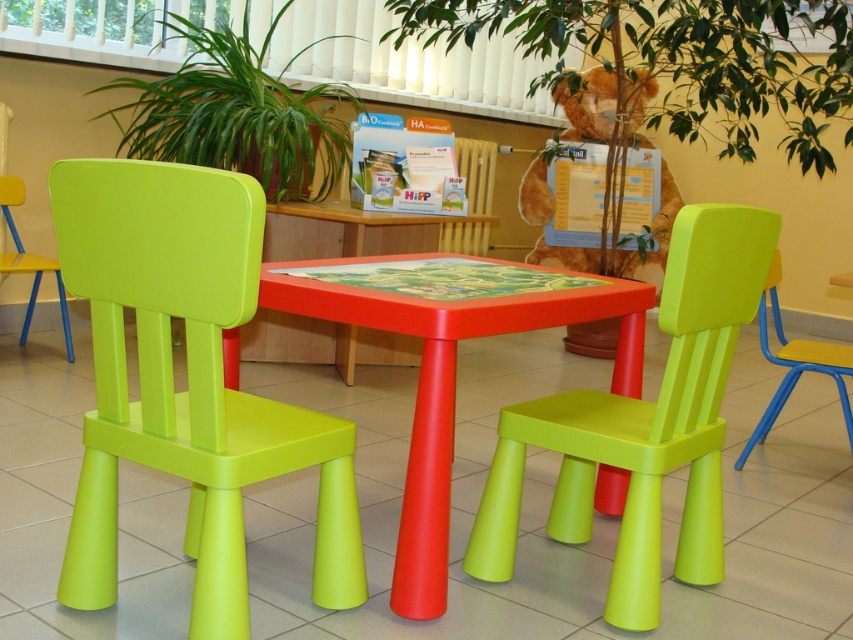
Question: Which object is the farthest from the lime matte plastic chair at center?

Choices:
 (A) lime green plastic chair at center
 (B) green plastic chair at center
 (C) green leafy plant at upper left

Answer: (C)

Question: Does lime matte plastic chair at center have a lesser width compared to lime green plastic chair at center?

Choices:
 (A) no
 (B) yes

Answer: (B)

Question: Which point is closer to the camera?

Choices:
 (A) green plastic chair at center
 (B) lime matte plastic chair at center
 (C) matte plastic table at center

Answer: (B)

Question: Can you confirm if green leafy plant at upper left is wider than red plastic table at center?

Choices:
 (A) no
 (B) yes

Answer: (B)

Question: Can you confirm if green leafy plant at upper left is positioned to the right of lime green plastic chair at left?

Choices:
 (A) yes
 (B) no

Answer: (A)

Question: Which point is farther to the camera?

Choices:
 (A) (700, 468)
 (B) (775, 330)
 (C) (10, 198)

Answer: (C)